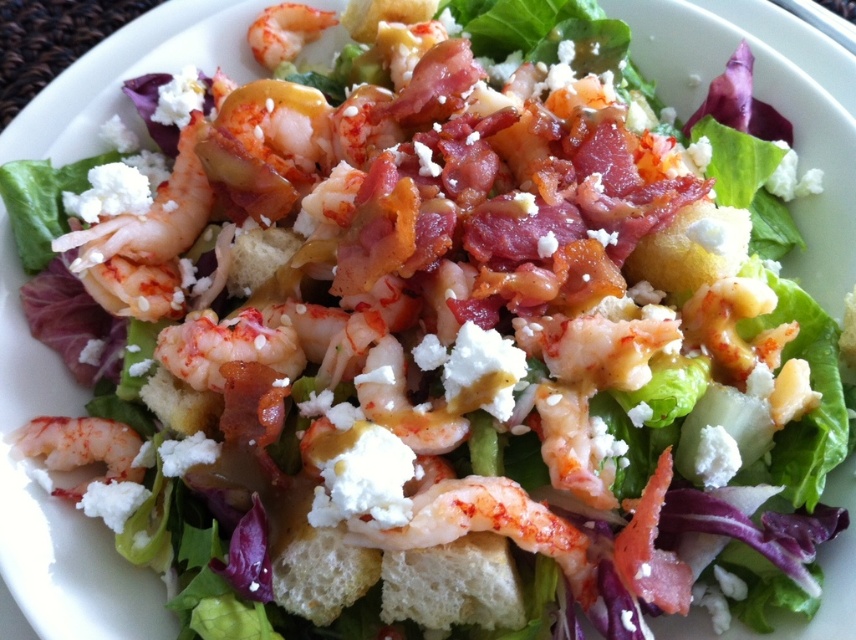
This screenshot has width=856, height=640. What do you see at coordinates (360, 476) in the screenshot? I see `white crumbly cheese at center` at bounding box center [360, 476].

Is white crumbly cheese at center below pink glossy shrimp at upper center?

Yes, white crumbly cheese at center is below pink glossy shrimp at upper center.

Is point (330, 444) positioned after point (254, 28)?

No, it is not.

This screenshot has width=856, height=640. What are the coordinates of `white crumbly cheese at center` in the screenshot? It's located at (360, 476).

The width and height of the screenshot is (856, 640). I want to click on white crumbly cheese at center, so click(360, 476).

At what (x,y) coordinates should I click in order to perform the action: click on white crumbly cheese at center. Please return your answer as a coordinate pair (x, y). Looking at the image, I should click on (360, 476).

Can you confirm if white crumbly shrimp at center is positioned to the left of pink glossy shrimp at upper center?

No, white crumbly shrimp at center is not to the left of pink glossy shrimp at upper center.

Is white crumbly shrimp at center shorter than pink glossy shrimp at upper center?

No, white crumbly shrimp at center is not shorter than pink glossy shrimp at upper center.

Between point (541, 509) and point (287, 28), which one is positioned in front?

Positioned in front is point (541, 509).

I want to click on white crumbly shrimp at center, so click(x=486, y=525).